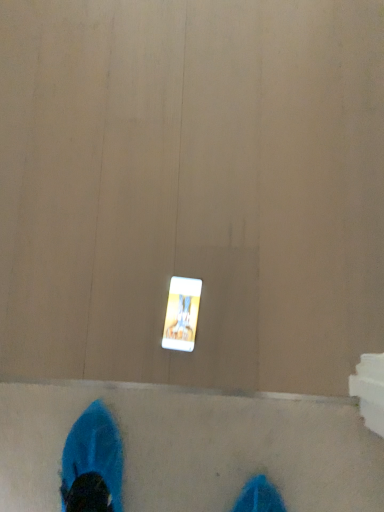
Locate an element on the screen. This screenshot has height=512, width=384. vacant area located to the right-hand side of white glossy mobile phone at center is located at coordinates (248, 287).